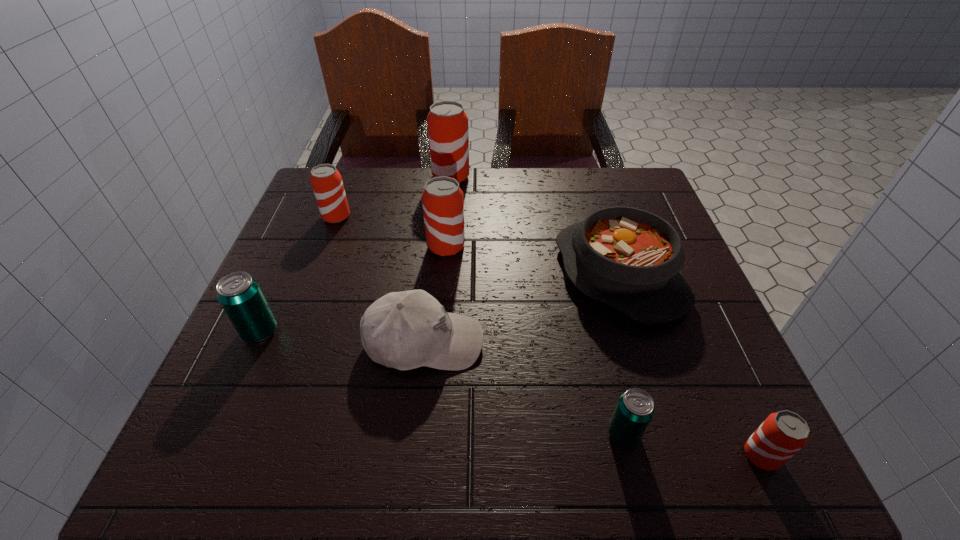
In the image, there is a desktop. Where is `blank space at the far right corner`? blank space at the far right corner is located at coordinates (631, 177).

Find the location of a particular element. Image resolution: width=960 pixels, height=540 pixels. vacant space at the near right corner is located at coordinates (689, 457).

Locate an element on the screen. vacant area that lies between the smallest orange beer can and the right teal beer can is located at coordinates (692, 444).

Locate an element on the screen. This screenshot has height=540, width=960. empty location between the third biggest orange beer can and the third smallest orange beer can is located at coordinates (392, 232).

Image resolution: width=960 pixels, height=540 pixels. What are the coordinates of `blank region between the second nearest orange beer can and the second farthest orange beer can` in the screenshot? It's located at (392, 232).

The image size is (960, 540). I want to click on vacant space that is in between the seventh shortest object and the smaller teal beer can, so click(535, 340).

Locate an element on the screen. The image size is (960, 540). free space between the smaller teal beer can and the left teal beer can is located at coordinates (442, 383).

Locate an element on the screen. Image resolution: width=960 pixels, height=540 pixels. vacant point located between the fourth farthest beer can and the baseball cap is located at coordinates (343, 337).

Locate an element on the screen. vacant region between the baseball cap and the fourth farthest beer can is located at coordinates (343, 337).

Where is `free space between the third nearest beer can and the rightmost beer can`? This screenshot has width=960, height=540. free space between the third nearest beer can and the rightmost beer can is located at coordinates (511, 394).